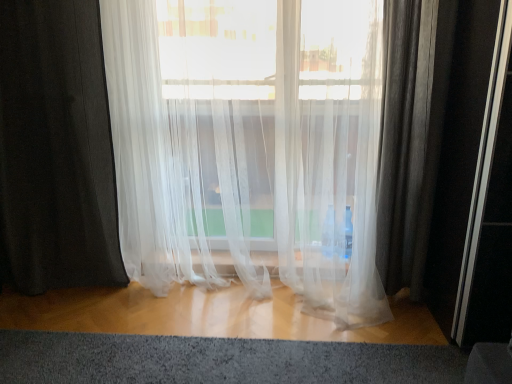
Identify the location of vacant space to the left of translucent white curtain at center, which is the 2th curtain from left to right. (88, 329).